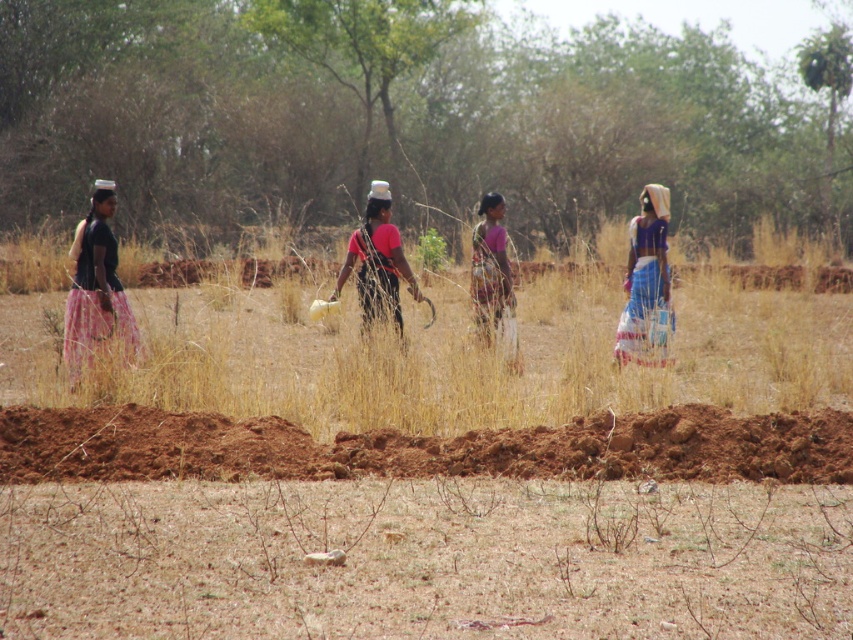
Question: Which point is closer to the camera?

Choices:
 (A) brown earth mound at lower center
 (B) brown soil at lower center

Answer: (B)

Question: Which of these objects is positioned farthest from the brown earth mound at lower center?

Choices:
 (A) brown soil at lower center
 (B) pink matte shirt at center
 (C) brown dry grass at center

Answer: (C)

Question: Does matte pink skirt at left appear over blue fabric skirt at right?

Choices:
 (A) no
 (B) yes

Answer: (B)

Question: Does matte pink skirt at left have a smaller size compared to pink matte shirt at center?

Choices:
 (A) yes
 (B) no

Answer: (A)

Question: Is brown dry grass at center smaller than matte pink skirt at left?

Choices:
 (A) yes
 (B) no

Answer: (B)

Question: Which object appears closest to the camera in this image?

Choices:
 (A) brown earth mound at lower center
 (B) pink fabric dress at center

Answer: (A)